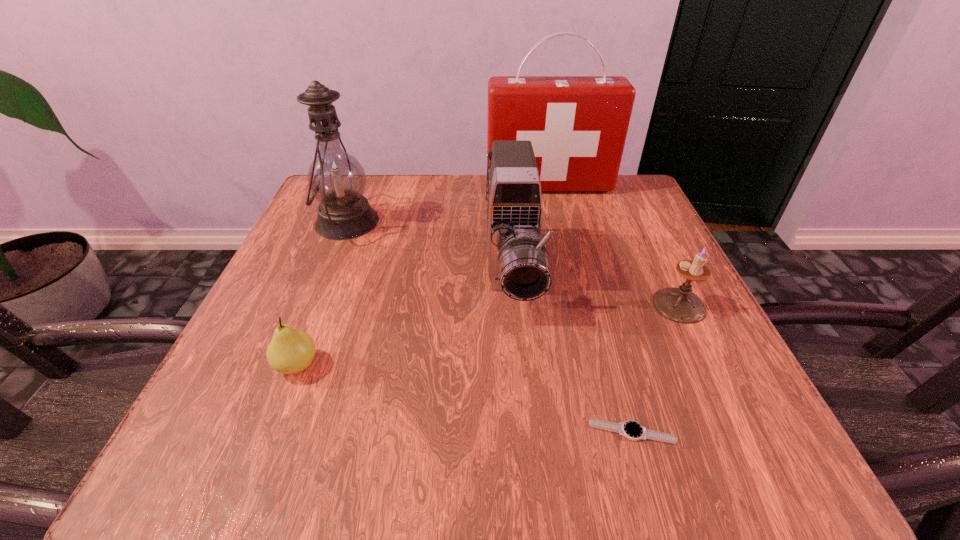
Identify the location of candle holder that is at the right edge. (680, 305).

Image resolution: width=960 pixels, height=540 pixels. I want to click on watch that is positioned at the right edge, so click(632, 430).

You are a GUI agent. You are given a task and a screenshot of the screen. Output one action in this format:
    pyautogui.click(x=<x>, y=<y>)
    Task: Click on the object present at the far left corner
    
    Given the screenshot: What is the action you would take?
    pyautogui.click(x=336, y=179)

I want to click on object that is at the far right corner, so click(577, 125).

At what (x,y) coordinates should I click in order to perform the action: click on object that is at the near right corner. Please return your answer as a coordinate pair (x, y). Looking at the image, I should click on (632, 430).

At what (x,y) coordinates should I click in order to perform the action: click on free space at the far edge. Please return your answer as a coordinate pair (x, y). The image size is (960, 540). Looking at the image, I should click on (462, 193).

In the image, there is a desktop. Identify the location of free region at the near edge. The width and height of the screenshot is (960, 540). (598, 451).

In the image, there is a desktop. Find the location of `free space at the left edge`. free space at the left edge is located at coordinates (295, 299).

Find the location of a particular element. The height and width of the screenshot is (540, 960). free space at the right edge of the desktop is located at coordinates (601, 259).

In the image, there is a desktop. At what (x,y) coordinates should I click in order to perform the action: click on vacant space at the near left corner. Please return your answer as a coordinate pair (x, y). Looking at the image, I should click on (249, 450).